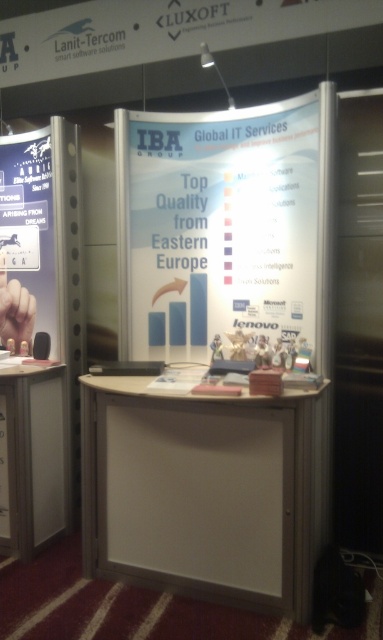
Question: Observing the image, what is the correct spatial positioning of white matte desk at center in reference to brushed metal poster at left?

Choices:
 (A) below
 (B) above

Answer: (A)

Question: Does white paper at center lie in front of white plastic information desk at lower left?

Choices:
 (A) yes
 (B) no

Answer: (A)

Question: Which point is farther from the camera taking this photo?

Choices:
 (A) (14, 449)
 (B) (1, 257)
 (C) (256, 451)
 (D) (289, 310)

Answer: (B)

Question: Which point is farther from the camera taking this photo?

Choices:
 (A) (291, 468)
 (B) (0, 221)
 (C) (273, 227)

Answer: (B)

Question: Which object appears closest to the camera in this image?

Choices:
 (A) brushed metal poster at left
 (B) white paper at center

Answer: (B)

Question: Can you confirm if white matte desk at center is positioned to the left of white plastic information desk at lower left?

Choices:
 (A) no
 (B) yes

Answer: (A)